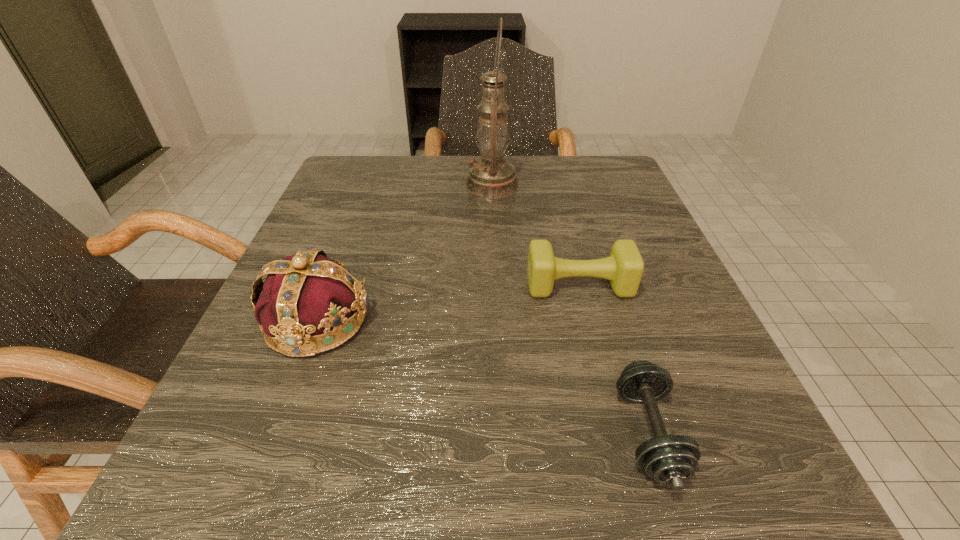
Find the location of `object that stands as the closest to the farthest object`. object that stands as the closest to the farthest object is located at coordinates (624, 268).

Choose which object is the third nearest neighbor to the oil lamp. Please provide its 2D coordinates. Your answer should be formatted as a tuple, i.e. [(x, y)], where the tuple contains the x and y coordinates of a point satisfying the conditions above.

[(672, 459)]

Locate an element on the screen. This screenshot has width=960, height=540. vacant region that satisfies the following two spatial constraints: 1. on the back side of the second tallest object; 2. on the left side of the farther dumbbell is located at coordinates (331, 285).

This screenshot has height=540, width=960. Find the location of `free spot that satisfies the following two spatial constraints: 1. on the front side of the nearer dumbbell; 2. on the left side of the third shortest object`. free spot that satisfies the following two spatial constraints: 1. on the front side of the nearer dumbbell; 2. on the left side of the third shortest object is located at coordinates coord(275,433).